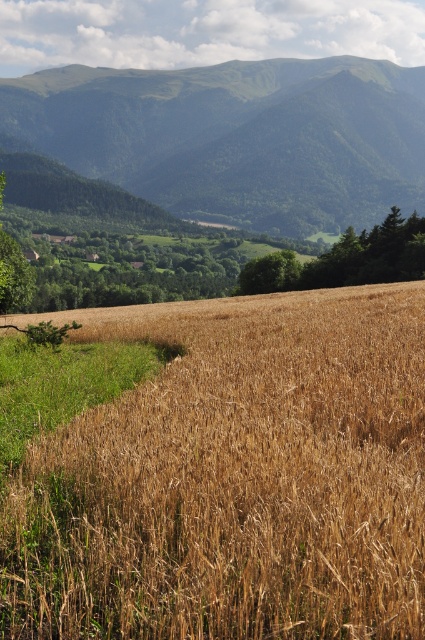
Question: Is brown grainy wheat field at lower left above green leafy tree at center?

Choices:
 (A) no
 (B) yes

Answer: (A)

Question: Which of the following is the farthest from the observer?

Choices:
 (A) (348, 118)
 (B) (10, 516)

Answer: (A)

Question: Among these points, which one is farthest from the camera?

Choices:
 (A) (79, 172)
 (B) (238, 346)

Answer: (A)

Question: Estimate the real-world distances between objects in this image. Which object is closer to the brown grainy wheat field at lower left?

Choices:
 (A) green grassy mountain at upper center
 (B) green leafy tree at center

Answer: (B)

Question: Can you confirm if brown grainy wheat field at lower left is positioned to the right of green grassy mountain at upper center?

Choices:
 (A) yes
 (B) no

Answer: (A)

Question: Does brown grainy wheat field at lower left appear over green leafy tree at center?

Choices:
 (A) no
 (B) yes

Answer: (A)